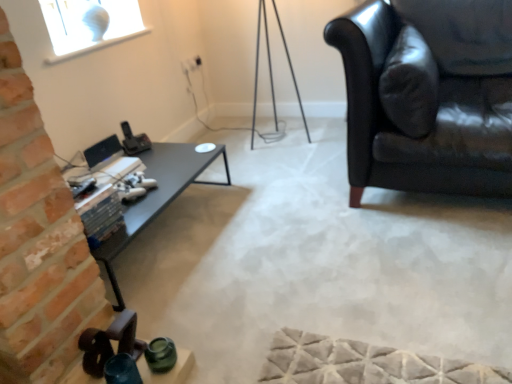
Find the location of a particular element. free region on the left part of black leather couch at right is located at coordinates (263, 221).